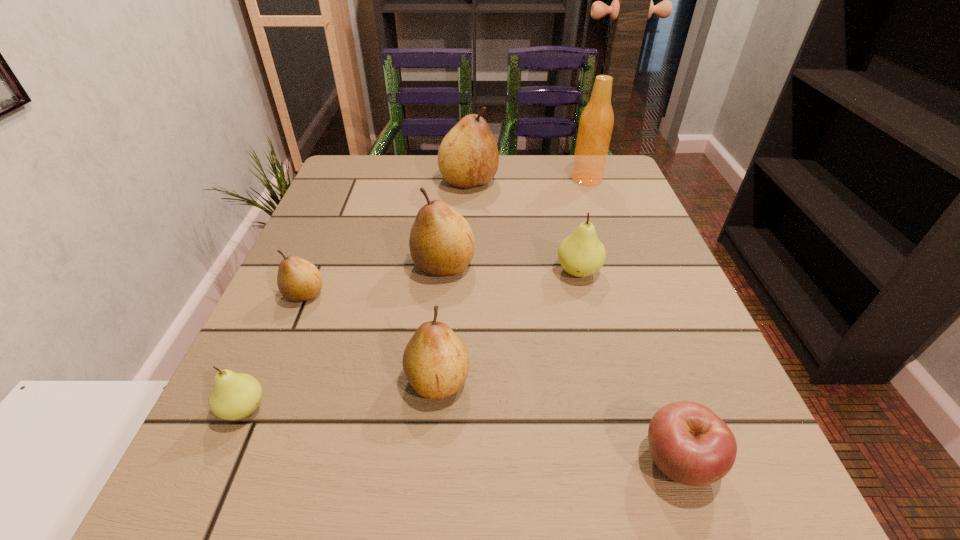
This screenshot has width=960, height=540. I want to click on tan beer bottle, so click(x=596, y=123).

Find the location of `the tallest object`. the tallest object is located at coordinates (596, 123).

This screenshot has width=960, height=540. Find the location of `the farthest brown pear`. the farthest brown pear is located at coordinates (468, 156).

Locate an element on the screen. The image size is (960, 540). the biggest brown pear is located at coordinates (468, 156).

At what (x,y) coordinates should I click in order to perform the action: click on the sixth shortest object. Please return your answer as a coordinate pair (x, y). Looking at the image, I should click on (441, 243).

You are a GUI agent. You are given a task and a screenshot of the screen. Output one action in this format:
    pyautogui.click(x=<x>, y=<y>)
    Task: Click on the second tallest pear
    The height and width of the screenshot is (540, 960).
    Given the screenshot: What is the action you would take?
    pyautogui.click(x=441, y=243)

Identify the location of the bigger green pear. (581, 254).

This screenshot has height=540, width=960. In order to click on the rightmost pear in this screenshot , I will do `click(581, 254)`.

Where is `the second smallest brown pear`? The image size is (960, 540). the second smallest brown pear is located at coordinates 436,363.

The height and width of the screenshot is (540, 960). I want to click on the leftmost brown pear, so [x=298, y=280].